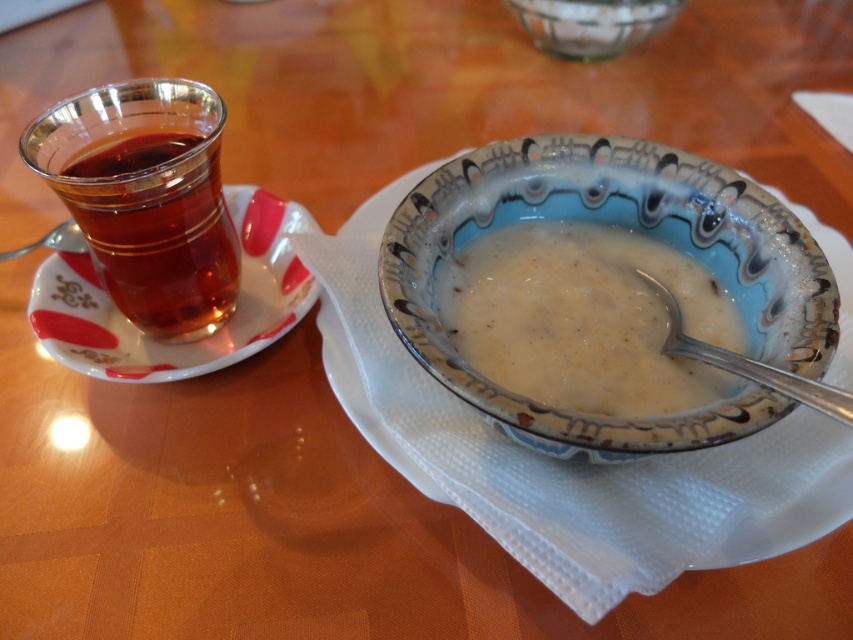
Question: Can you confirm if white ceramic saucer at left is bigger than metallic silver spoon at left?

Choices:
 (A) yes
 (B) no

Answer: (A)

Question: Does transparent glass tea at left appear under silver metallic spoon at bowl center?

Choices:
 (A) yes
 (B) no

Answer: (B)

Question: Which object is positioned closest to the white creamy soup at center?

Choices:
 (A) metallic silver spoon at left
 (B) transparent glass tea at left

Answer: (B)

Question: Which of the following is the farthest from the observer?

Choices:
 (A) white creamy soup at center
 (B) transparent glass tea at left

Answer: (B)

Question: Does transparent glass tea at left have a smaller size compared to silver metallic spoon at bowl center?

Choices:
 (A) no
 (B) yes

Answer: (A)

Question: Which point is farther to the camera?

Choices:
 (A) porcelain bowl at center
 (B) transparent glass tea at left

Answer: (B)